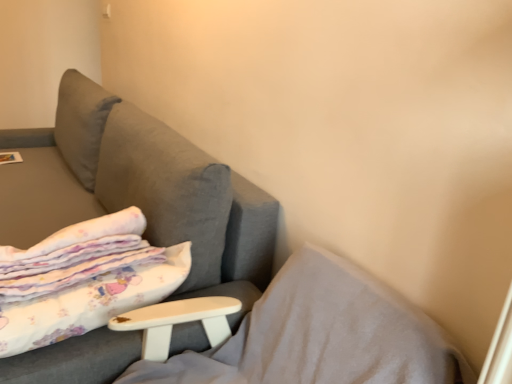
Describe the element at coordinates (321, 335) in the screenshot. I see `white soft pillow at lower left` at that location.

Find the location of a particular element. The width and height of the screenshot is (512, 384). matte white magazine at upper left is located at coordinates (10, 157).

At what (x,y) coordinates should I click in order to perform the action: click on white cotton blanket at left. Please return your answer as a coordinate pair (x, y). This screenshot has width=512, height=384. Looking at the image, I should click on (83, 280).

In the image, there is a white soft pillow at lower left. At what (x,y) coordinates should I click in order to perform the action: click on bed above it (from the image's perspective). Please return your answer as a coordinate pair (x, y). This screenshot has height=384, width=512. Looking at the image, I should click on (83, 280).

Between point (27, 334) and point (362, 292), which one is positioned behind?

Positioned behind is point (362, 292).

Between white cotton blanket at left and white soft pillow at lower left, which one has less height?

white cotton blanket at left.

Can matte white magazine at upper left be found inside white soft pillow at lower left?

No.

Considering the relative sizes of white soft pillow at lower left and matte white magazine at upper left in the image provided, is white soft pillow at lower left shorter than matte white magazine at upper left?

Incorrect, the height of white soft pillow at lower left does not fall short of that of matte white magazine at upper left.

Which is in front, white soft pillow at lower left or matte white magazine at upper left?

white soft pillow at lower left.

In the scene shown: How far apart are white soft pillow at lower left and matte white magazine at upper left?

white soft pillow at lower left is 6.66 feet away from matte white magazine at upper left.

Are matte white magazine at upper left and white soft pillow at lower left far apart?

Yes.

In the scene shown: Is the position of matte white magazine at upper left less distant than that of white soft pillow at lower left?

No.

Does matte white magazine at upper left have a lesser height compared to white soft pillow at lower left?

Yes, matte white magazine at upper left is shorter than white soft pillow at lower left.

Is white cotton blanket at left oriented towards matte white magazine at upper left?

No, white cotton blanket at left is not aimed at matte white magazine at upper left.

Which is less distant, (21,297) or (3,162)?

Point (21,297) appears to be closer to the viewer than point (3,162).

Is white cotton blanket at left completely or partially outside of matte white magazine at upper left?

white cotton blanket at left lies outside matte white magazine at upper left's area.

From a real-world perspective, relative to matte white magazine at upper left, is white cotton blanket at left vertically above or below?

In terms of real-world spatial position, white cotton blanket at left is above matte white magazine at upper left.

Is matte white magazine at upper left taller than white cotton blanket at left?

Incorrect, the height of matte white magazine at upper left is not larger of that of white cotton blanket at left.

Can you confirm if matte white magazine at upper left is positioned to the right of white cotton blanket at left?

In fact, matte white magazine at upper left is to the left of white cotton blanket at left.

Is matte white magazine at upper left aimed at white cotton blanket at left?

No, matte white magazine at upper left is not aimed at white cotton blanket at left.

Considering the relative sizes of matte white magazine at upper left and white cotton blanket at left in the image provided, is matte white magazine at upper left smaller than white cotton blanket at left?

Yes, matte white magazine at upper left is smaller than white cotton blanket at left.

From the image's perspective, which is above, white soft pillow at lower left or white cotton blanket at left?

white cotton blanket at left.

Is white soft pillow at lower left inside the boundaries of white cotton blanket at left, or outside?

white soft pillow at lower left exists outside the volume of white cotton blanket at left.

From a real-world perspective, is white soft pillow at lower left physically below white cotton blanket at left?

Yes, from a real-world perspective, white soft pillow at lower left is beneath white cotton blanket at left.

Which of these two, white soft pillow at lower left or white cotton blanket at left, stands taller?

white soft pillow at lower left is taller.

At what (x,y) coordinates should I click in order to perform the action: click on bed that is above the white soft pillow at lower left (from a real-world perspective). Please return your answer as a coordinate pair (x, y). This screenshot has height=384, width=512. Looking at the image, I should click on (83, 280).

Where is `magazine below the white soft pillow at lower left (from a real-world perspective)`? Image resolution: width=512 pixels, height=384 pixels. magazine below the white soft pillow at lower left (from a real-world perspective) is located at coordinates (10, 157).

Based on their spatial positions, is matte white magazine at upper left or white cotton blanket at left further from white soft pillow at lower left?

matte white magazine at upper left is positioned further to the anchor white soft pillow at lower left.

Looking at the image, which one is located closer to matte white magazine at upper left, white soft pillow at lower left or white cotton blanket at left?

white cotton blanket at left is positioned closer to the anchor matte white magazine at upper left.

Which object lies nearer to the anchor point white cotton blanket at left, white soft pillow at lower left or matte white magazine at upper left?

white soft pillow at lower left is positioned closer to the anchor white cotton blanket at left.

Based on their spatial positions, is white cotton blanket at left or white soft pillow at lower left further from matte white magazine at upper left?

Among the two, white soft pillow at lower left is located further to matte white magazine at upper left.

Considering their positions, is white cotton blanket at left positioned closer to white soft pillow at lower left than matte white magazine at upper left?

The object closer to white soft pillow at lower left is white cotton blanket at left.

Consider the image. Which object lies further to the anchor point white cotton blanket at left, matte white magazine at upper left or white soft pillow at lower left?

matte white magazine at upper left lies further to white cotton blanket at left than the other object.

Find the location of `bed between white soft pillow at lower left and matte white magazine at upper left from front to back`. bed between white soft pillow at lower left and matte white magazine at upper left from front to back is located at coordinates 83,280.